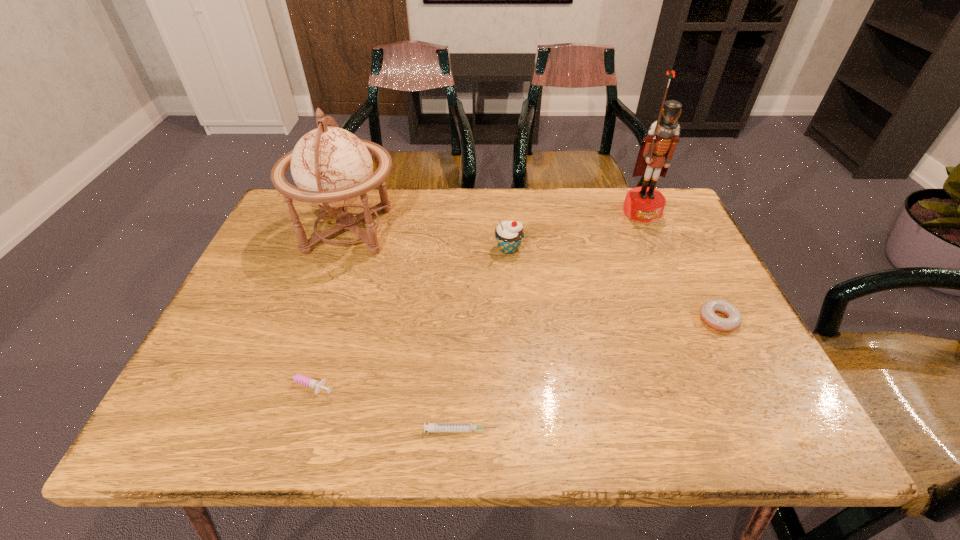
Identify the location of free space located 0.320m on the front-facing side of the nutcracker. (684, 305).

You are a GUI agent. You are given a task and a screenshot of the screen. Output one action in this format:
    pyautogui.click(x=<x>, y=<y>)
    Task: Click on the vacant area situated 0.310m at the front of the fifth shortest object showing Africa
    This screenshot has width=960, height=540.
    Given the screenshot: What is the action you would take?
    pyautogui.click(x=512, y=231)

Identify the location of free space located on the right of the cupcake. The image size is (960, 540). (580, 249).

What are the coordinates of `vacant space located on the back of the third nearest object` in the screenshot? It's located at (696, 276).

The width and height of the screenshot is (960, 540). Find the location of `free space located 0.130m on the right of the left syringe`. free space located 0.130m on the right of the left syringe is located at coordinates (400, 385).

In order to click on vacant space located 0.280m at the needle end of the nearer syringe in this screenshot , I will do `click(648, 430)`.

Locate an element on the screen. The width and height of the screenshot is (960, 540). nutcracker that is at the far edge is located at coordinates (645, 204).

Locate an element on the screen. globe that is at the far edge is located at coordinates (332, 167).

Locate an element on the screen. Image resolution: width=960 pixels, height=540 pixels. object positioned at the near edge is located at coordinates (431, 427).

Find the location of `object at the left edge`. object at the left edge is located at coordinates (332, 167).